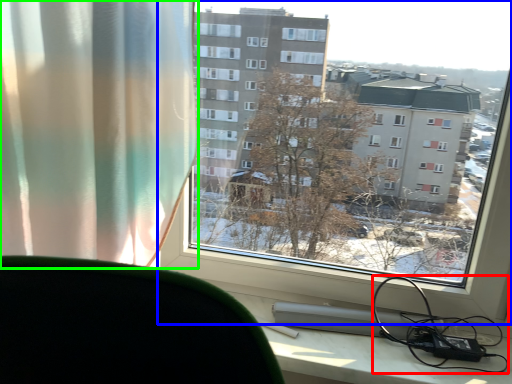
Question: Which object is the closest to the cable (highlighted by a red box)? Choose among these: window (highlighted by a blue box) or curtain (highlighted by a green box).

Choices:
 (A) window
 (B) curtain

Answer: (A)